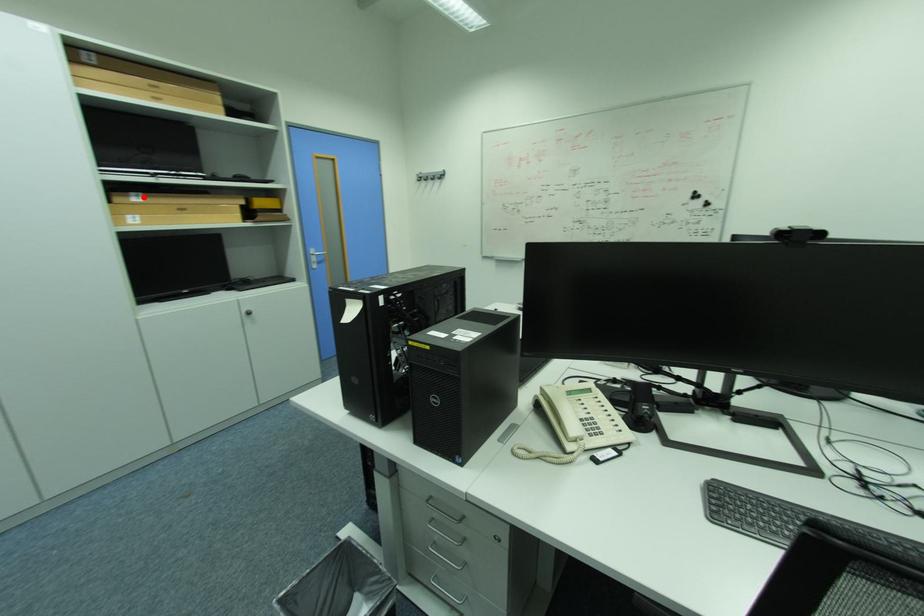
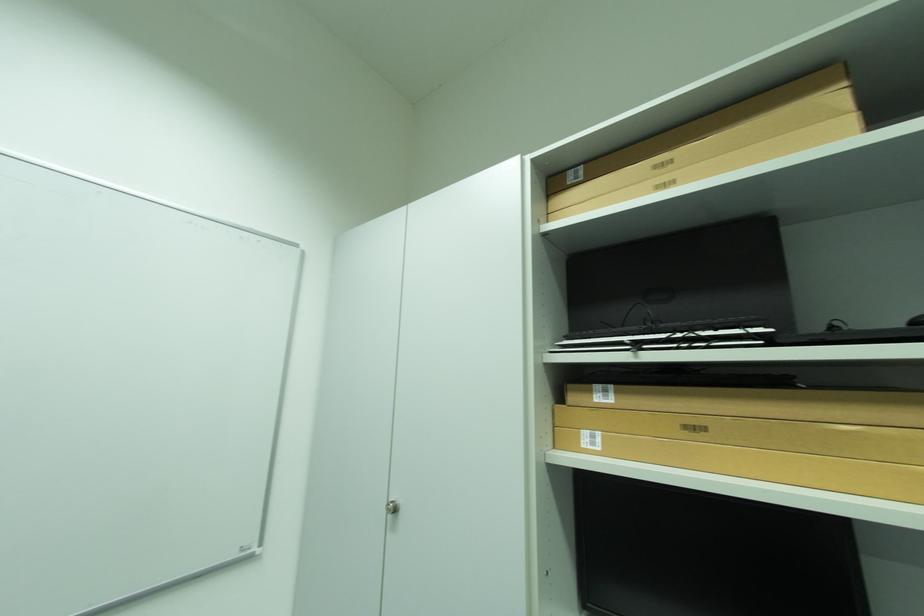
Locate, in the second image, the point that corresponds to the highlighted location in the first image.

(614, 392)